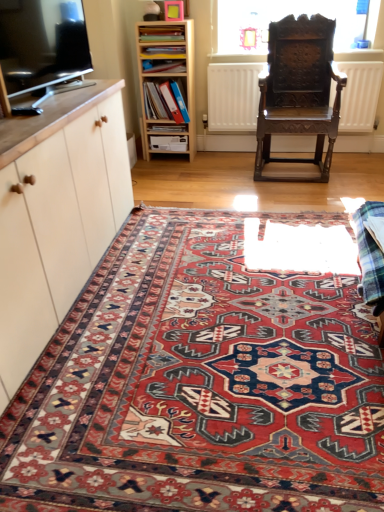
Identify the location of vacant region to the left of plaid fabric at lower right. [303, 302].